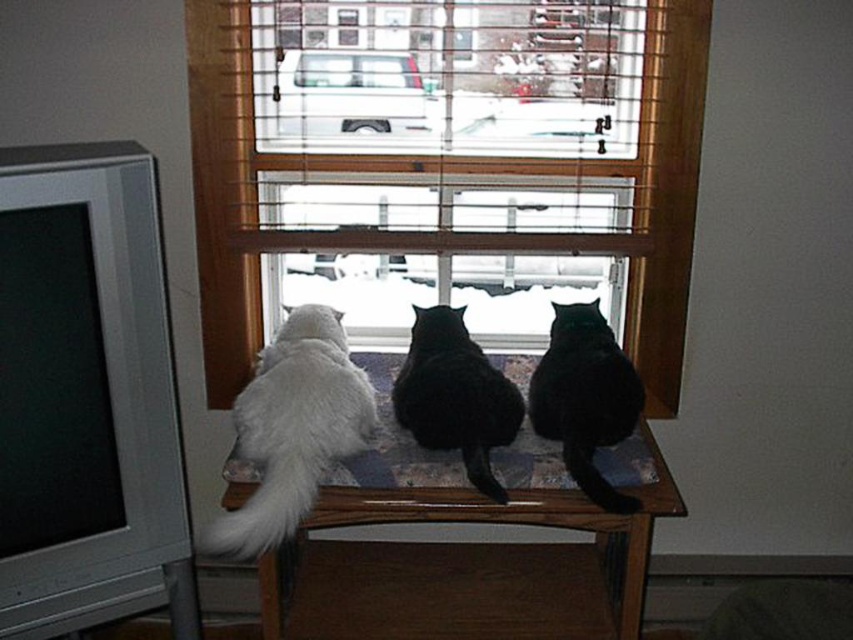
Question: Observing the image, what is the correct spatial positioning of wooden table at center in reference to white fluffy cat at center?

Choices:
 (A) right
 (B) left

Answer: (A)

Question: Is wooden table at center below black glossy cat at center?

Choices:
 (A) yes
 (B) no

Answer: (A)

Question: Which object appears farthest from the camera in this image?

Choices:
 (A) white fluffy cat at center
 (B) wooden table at center
 (C) black fur cat at center
 (D) black glossy cat at center

Answer: (B)

Question: Which of these objects is positioned closest to the white fluffy cat at center?

Choices:
 (A) black glossy cat at center
 (B) black fur cat at center

Answer: (A)

Question: Which object appears closest to the camera in this image?

Choices:
 (A) black fur cat at center
 (B) black glossy cat at center
 (C) wooden table at center
 (D) wooden frame at center

Answer: (B)

Question: Considering the relative positions of wooden frame at center and black glossy cat at center in the image provided, where is wooden frame at center located with respect to black glossy cat at center?

Choices:
 (A) above
 (B) below

Answer: (A)